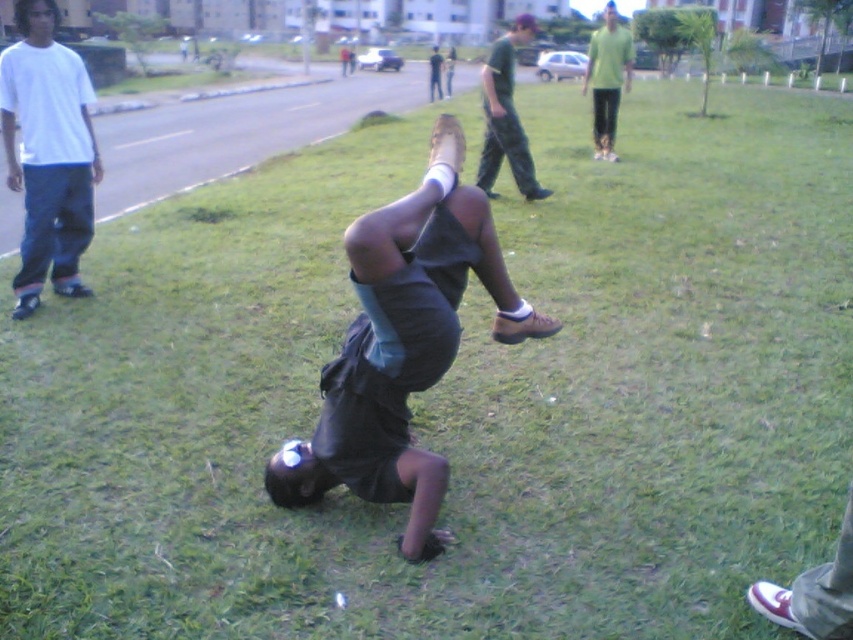
Who is more distant from viewer, (490, 172) or (437, 83)?

The point (437, 83) is behind.

Which is more to the left, dark green t-shirt at center or dark gray shirt at center?

From the viewer's perspective, dark gray shirt at center appears more on the left side.

Where is `dark green t-shirt at center`? The image size is (853, 640). dark green t-shirt at center is located at coordinates click(x=505, y=116).

Does dark gray fabric squat at center appear on the right side of dark gray shirt at center?

Yes, dark gray fabric squat at center is to the right of dark gray shirt at center.

Between dark gray fabric squat at center and dark gray shirt at center, which one has less height?

With less height is dark gray fabric squat at center.

This screenshot has height=640, width=853. I want to click on dark gray fabric squat at center, so click(x=405, y=342).

Locate an element on the screen. dark gray fabric squat at center is located at coordinates (405, 342).

Does point (537, 193) come farther from viewer compared to point (593, 106)?

No, (537, 193) is in front of (593, 106).

Who is more forward, (512, 29) or (602, 36)?

Point (602, 36) is more forward.

You are a GUI agent. You are given a task and a screenshot of the screen. Output one action in this format:
    pyautogui.click(x=<x>, y=<y>)
    Task: Click on the dark green t-shirt at center
    
    Given the screenshot: What is the action you would take?
    tap(505, 116)